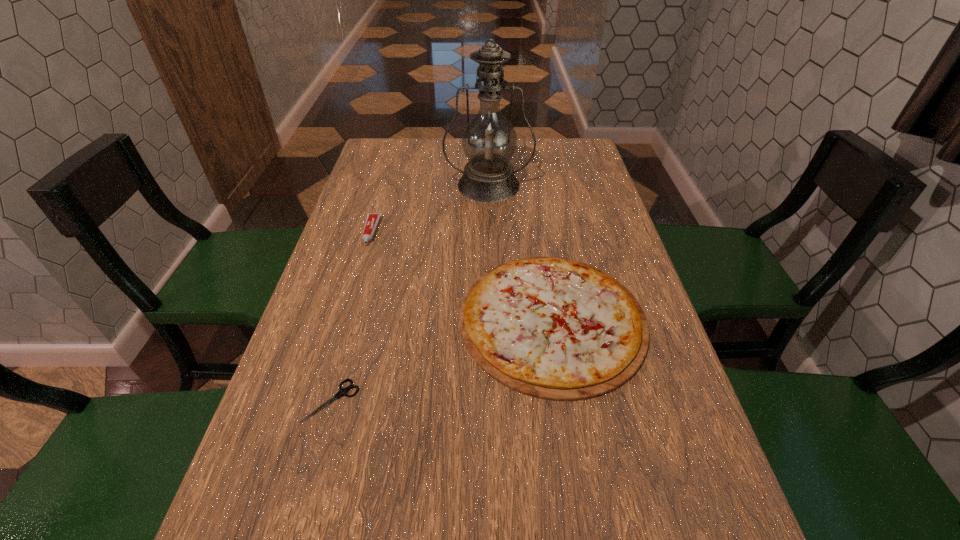
The height and width of the screenshot is (540, 960). In order to click on object located in the far edge section of the desktop in this screenshot , I will do `click(489, 140)`.

This screenshot has width=960, height=540. Identify the location of toothpaste located at the left edge. (372, 220).

Locate an element on the screen. Image resolution: width=960 pixels, height=540 pixels. shears that is at the left edge is located at coordinates (342, 391).

This screenshot has height=540, width=960. I want to click on object that is at the right edge, so click(553, 328).

In the image, there is a desktop. What are the coordinates of `vacant area at the far edge` in the screenshot? It's located at (463, 156).

This screenshot has width=960, height=540. Find the location of `free region at the left edge`. free region at the left edge is located at coordinates (382, 173).

At what (x,y) coordinates should I click in order to perform the action: click on free space at the right edge. Please return your answer as a coordinate pair (x, y). The height and width of the screenshot is (540, 960). Looking at the image, I should click on (593, 237).

Identify the location of vacant space at the far right corner of the desktop. (591, 159).

Locate an element on the screen. The height and width of the screenshot is (540, 960). vacant space that is in between the second tallest object and the shears is located at coordinates (351, 316).

This screenshot has width=960, height=540. Identify the location of empty location between the second shortest object and the shortest object. click(443, 360).